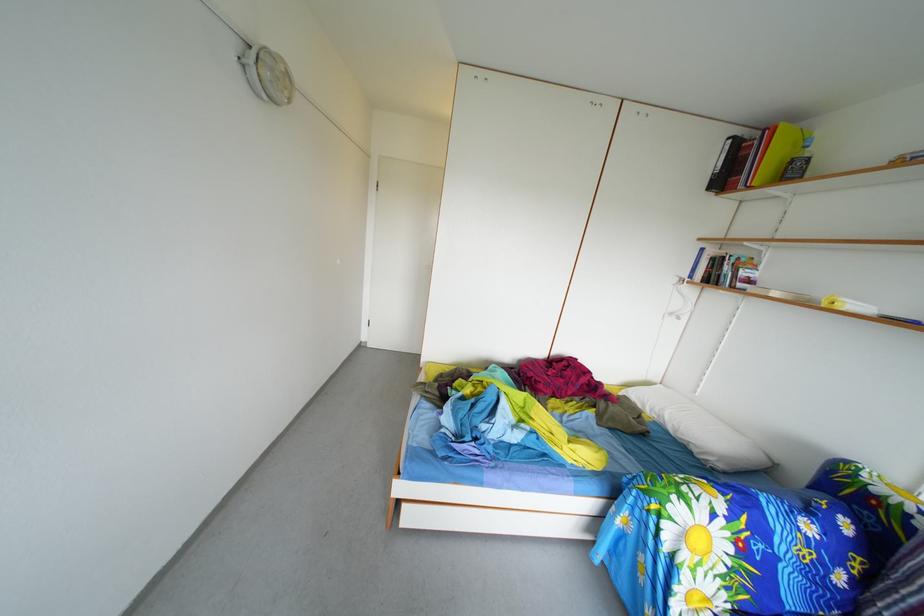
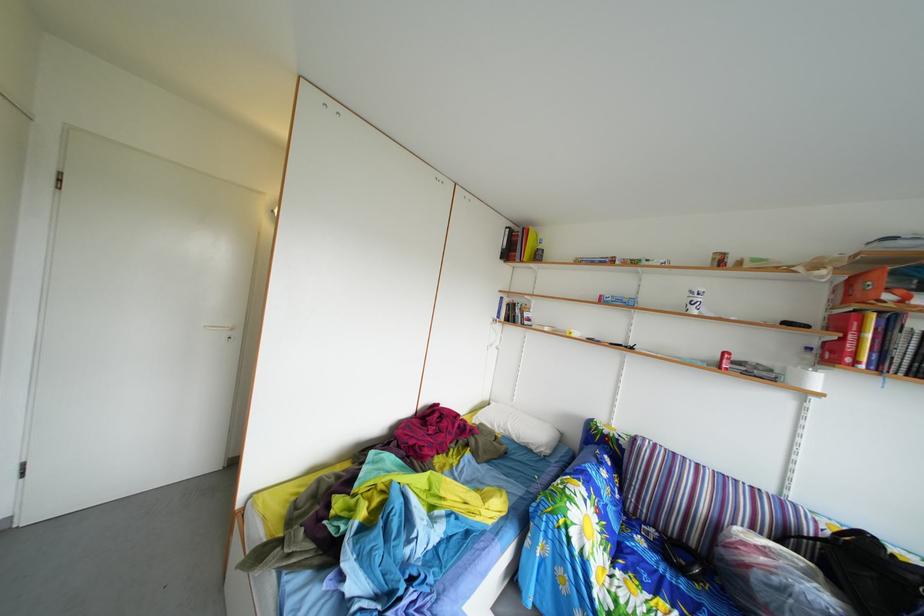
Question: How did the camera likely rotate?

Choices:
 (A) Left
 (B) Right
 (C) Up
 (D) Down

Answer: (B)